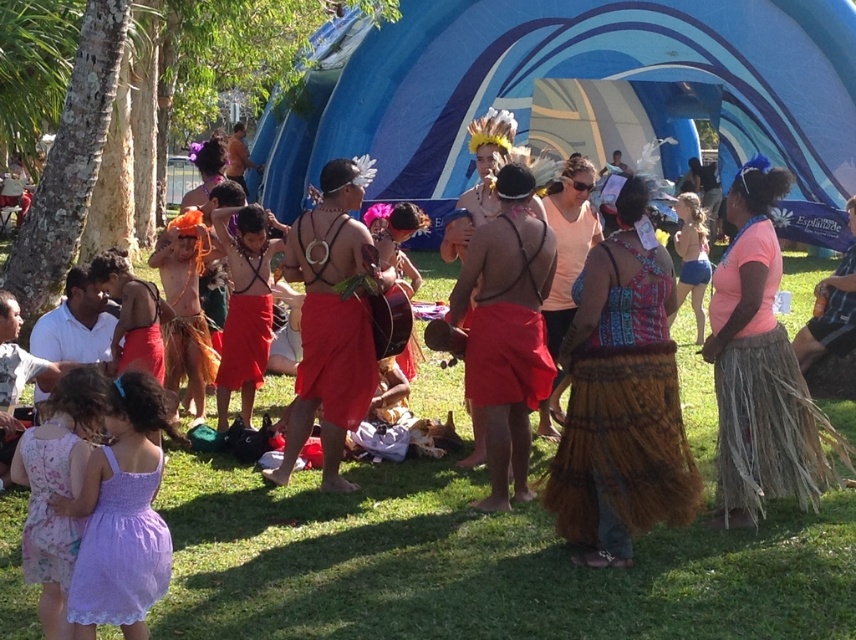
Question: Does blue fabric tent at center appear under pink woven grass skirt at center?

Choices:
 (A) yes
 (B) no

Answer: (B)

Question: Among these points, which one is farthest from the camera?

Choices:
 (A) (307, 291)
 (B) (242, 477)
 (C) (823, 355)

Answer: (C)

Question: Which point appears farthest from the camera in this image?

Choices:
 (A) (629, 356)
 (B) (153, 496)
 (C) (852, 214)
 (D) (382, 499)

Answer: (C)

Question: Does pink woven grass skirt at center appear over brown woven skirt at lower right?

Choices:
 (A) yes
 (B) no

Answer: (B)

Question: Observing the image, what is the correct spatial positioning of lavender lace dress at lower left in reference to brown woven skirt at lower right?

Choices:
 (A) left
 (B) right

Answer: (A)

Question: Among these points, which one is farthest from the camera?

Choices:
 (A) (693, 580)
 (B) (301, 348)
 (C) (764, 163)

Answer: (B)